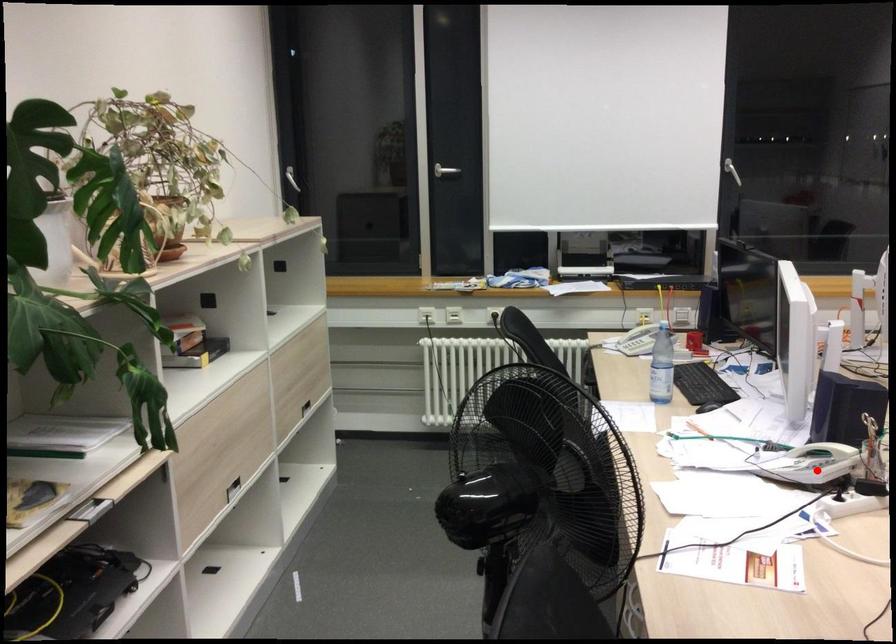
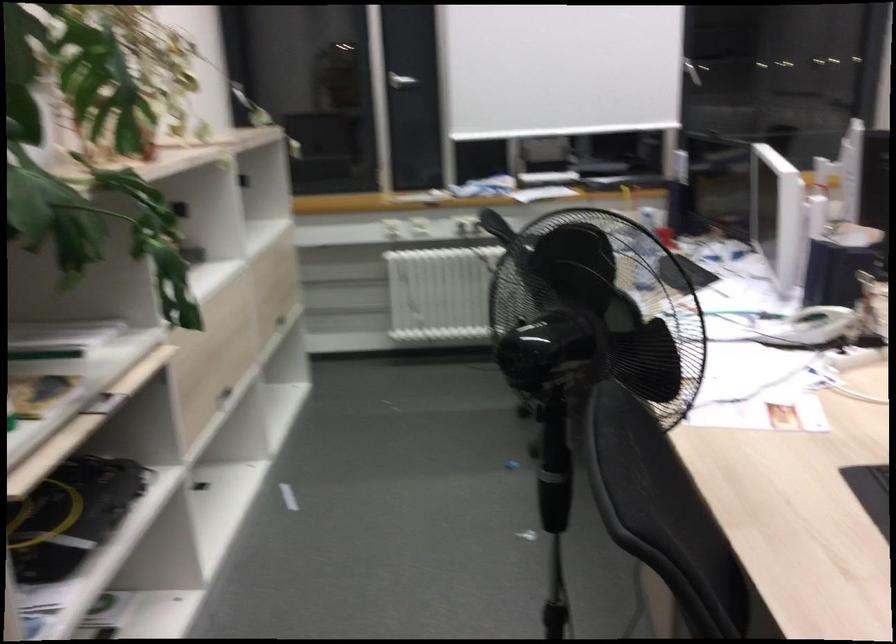
Where in the second image is the point corresponding to the highlighted location from the first image?

(811, 327)